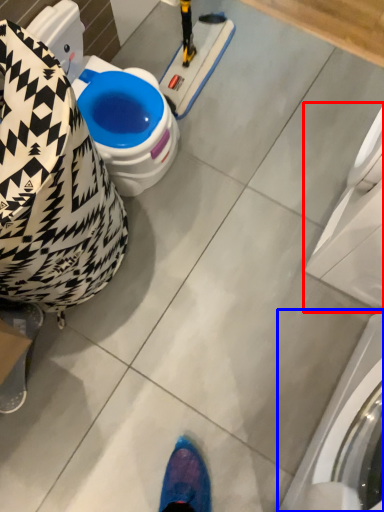
Question: Which object appears farthest to the camera in this image, washing machine (highlighted by a red box) or washing machine (highlighted by a blue box)?

Choices:
 (A) washing machine
 (B) washing machine

Answer: (A)